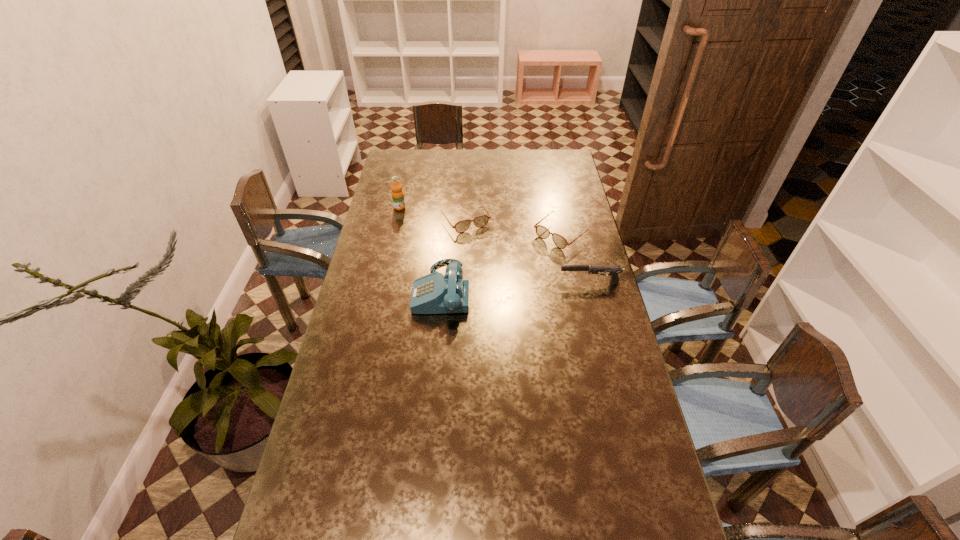
At what (x,y) coordinates should I click in order to perform the action: click on vacant space located 0.360m at the muzzle end of the third shortest object. Please return your answer as a coordinate pair (x, y). Image resolution: width=960 pixels, height=540 pixels. Looking at the image, I should click on (462, 282).

Where is `vacant space located at the muzzle end of the third shortest object`? vacant space located at the muzzle end of the third shortest object is located at coordinates (478, 282).

What are the coordinates of `free location located 0.320m on the front-facing side of the left sunglasses` in the screenshot? It's located at (510, 285).

At what (x,y) coordinates should I click in order to perform the action: click on vacant point located on the front-facing side of the left sunglasses. Please return your answer as a coordinate pair (x, y). The height and width of the screenshot is (540, 960). Looking at the image, I should click on (515, 292).

Find the location of `free location located 0.130m on the front-facing side of the left sunglasses`. free location located 0.130m on the front-facing side of the left sunglasses is located at coordinates (488, 253).

Find the location of `free region located on the label of the leftmost object`. free region located on the label of the leftmost object is located at coordinates (465, 251).

Find the location of a particular element. The image size is (960, 540). vacant space situated on the label of the leftmost object is located at coordinates (454, 244).

Identify the location of free location located 0.120m on the label of the leftmost object. (420, 221).

Find the location of a particular element. The width and height of the screenshot is (960, 540). free space located on the front-facing side of the right sunglasses is located at coordinates (492, 290).

Locate an element on the screen. vacant space situated on the front-facing side of the right sunglasses is located at coordinates (519, 268).